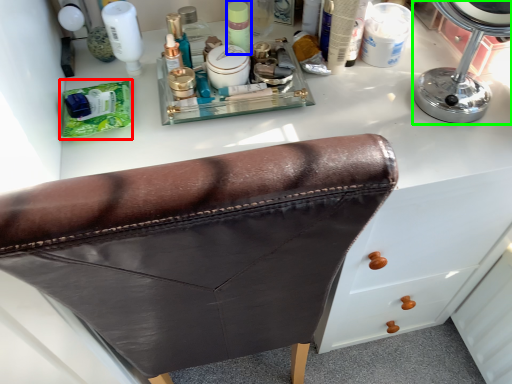
Question: Which object is positioned farthest from product (highlighted by a red box)? Select from toiletry (highlighted by a blue box) and mirror (highlighted by a green box).

Choices:
 (A) toiletry
 (B) mirror

Answer: (B)